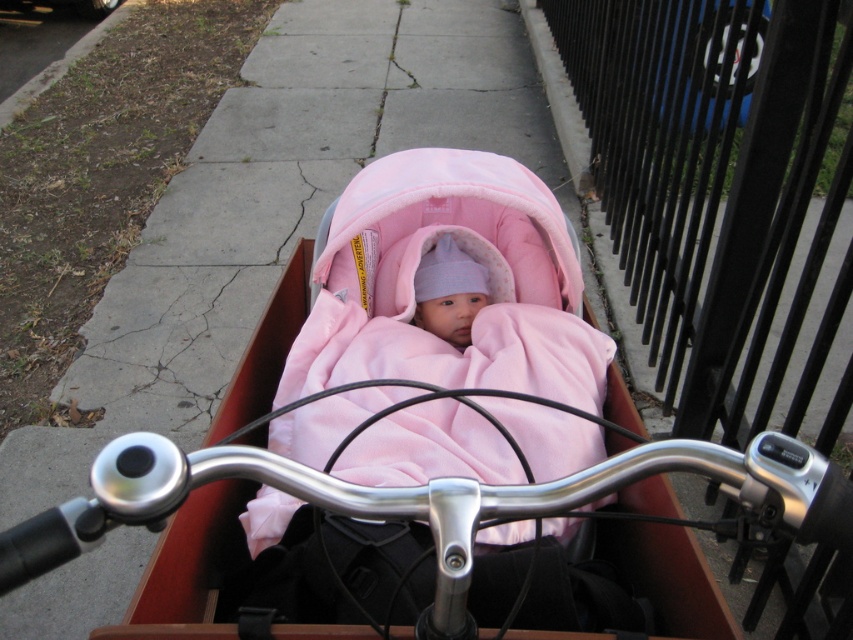
You are a parent riding a bicycle with a baby carriage attached. You need to check if the baby is facing towards the front of the bike. Based on the scene, is the pink fleece baby at center facing the same direction as the matte pink fabric baby carriage at center?

The matte pink fabric baby carriage at center is to the left of pink fleece baby at center, which means the baby is facing towards the front of the bike since the carriage is positioned in front of the baby.

You are riding a bicycle and want to attach a basket to the front handlebars. However, you notice the matte pink fabric baby carriage at center is currently in front. Can you attach the basket to the polished silver handlebars at center without moving the baby carriage?

The polished silver handlebars at center is behind the matte pink fabric baby carriage at center, so you cannot attach the basket to the polished silver handlebars at center without moving the baby carriage.

You are riding a bicycle and want to attach a baby carriage to the front. The baby carriage must be placed exactly at point (476, 291). Where should you position the baby carriage relative to the bicycle handlebars?

The matte pink fabric baby carriage at center should be positioned exactly at point (476, 291), which is the specified location relative to the bicycle handlebars.